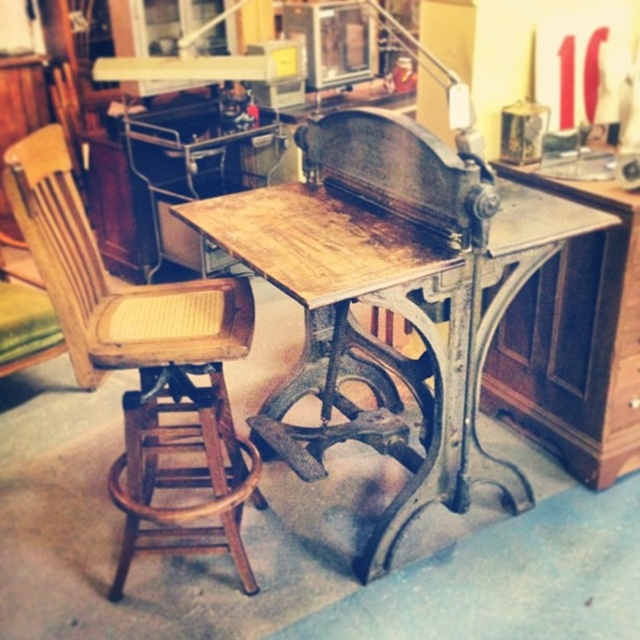
Which is in front, point (221, 472) or point (620, 369)?

Point (221, 472)

Does point (157, 440) come farther from viewer compared to point (630, 376)?

No, (157, 440) is in front of (630, 376).

Locate an element on the screen. This screenshot has width=640, height=640. wooden cane seat at left is located at coordinates (144, 362).

Can you confirm if wooden table at center is wider than wooden cane seat at left?

Yes, wooden table at center is wider than wooden cane seat at left.

Looking at this image, which of these two, wooden table at center or wooden cane seat at left, stands taller?

With more height is wooden cane seat at left.

Which is in front, point (468, 272) or point (220, 419)?

Point (468, 272)

The image size is (640, 640). I want to click on wooden table at center, so click(397, 314).

Find the location of a particular element. This screenshot has height=640, width=640. wooden table at center is located at coordinates (397, 314).

Who is taller, wooden table at center or wooden drawer at center?

Standing taller between the two is wooden table at center.

Is point (262, 211) behind point (627, 422)?

No.

The image size is (640, 640). Find the location of `wooden table at center`. wooden table at center is located at coordinates (397, 314).